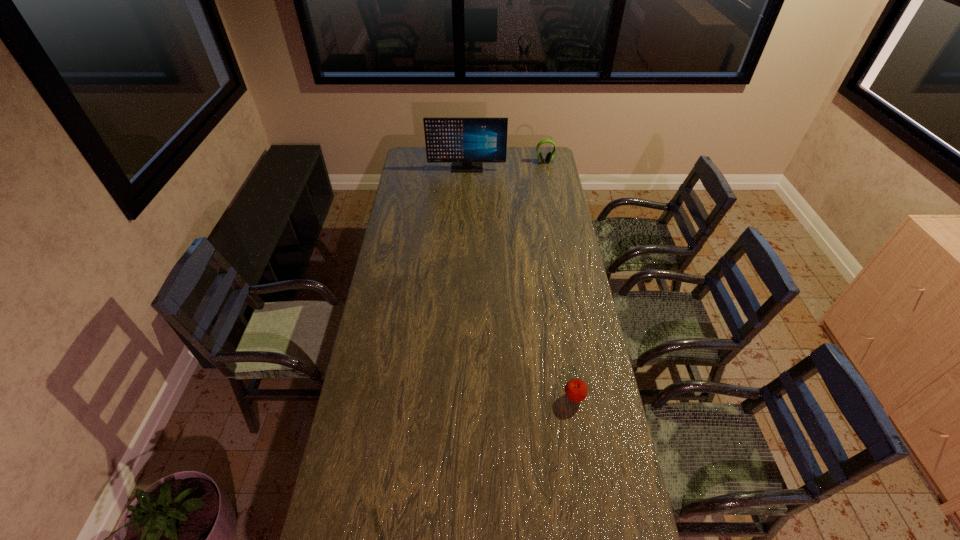
The image size is (960, 540). I want to click on object that is at the left edge, so click(x=467, y=143).

This screenshot has height=540, width=960. Identify the location of headset at the right edge. (549, 156).

This screenshot has width=960, height=540. Identify the location of apple present at the right edge. (576, 390).

Locate an element on the screen. The image size is (960, 540). object at the far left corner is located at coordinates [x=467, y=143].

This screenshot has height=540, width=960. Identify the location of object positioned at the far right corner. (549, 156).

Where is `free space at the far edge`? This screenshot has width=960, height=540. free space at the far edge is located at coordinates (516, 150).

The image size is (960, 540). Find the location of `free spot at the left edge of the desktop`. free spot at the left edge of the desktop is located at coordinates (374, 516).

I want to click on vacant area at the right edge of the desktop, so click(554, 173).

Image resolution: width=960 pixels, height=540 pixels. In the image, there is a desktop. In order to click on free space at the far right corner in this screenshot , I will do `click(544, 168)`.

Locate an element on the screen. Image resolution: width=960 pixels, height=540 pixels. vacant area that lies between the computer monitor and the headset is located at coordinates (506, 165).